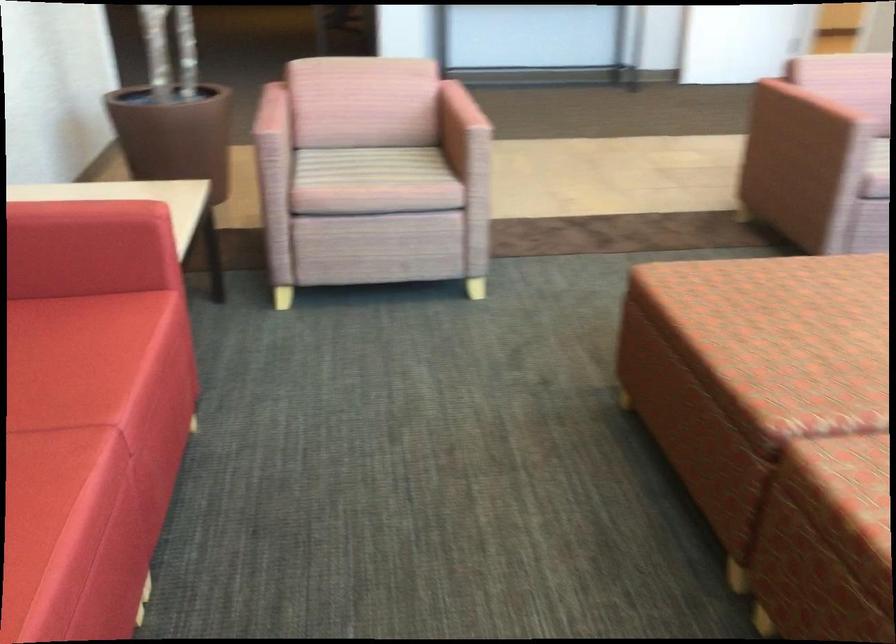
At what (x,y) coordinates should I click in order to perform the action: click on red sofa sitting surface. Please return your answer as a coordinate pair (x, y). This screenshot has height=644, width=896. Looking at the image, I should click on (69, 360).